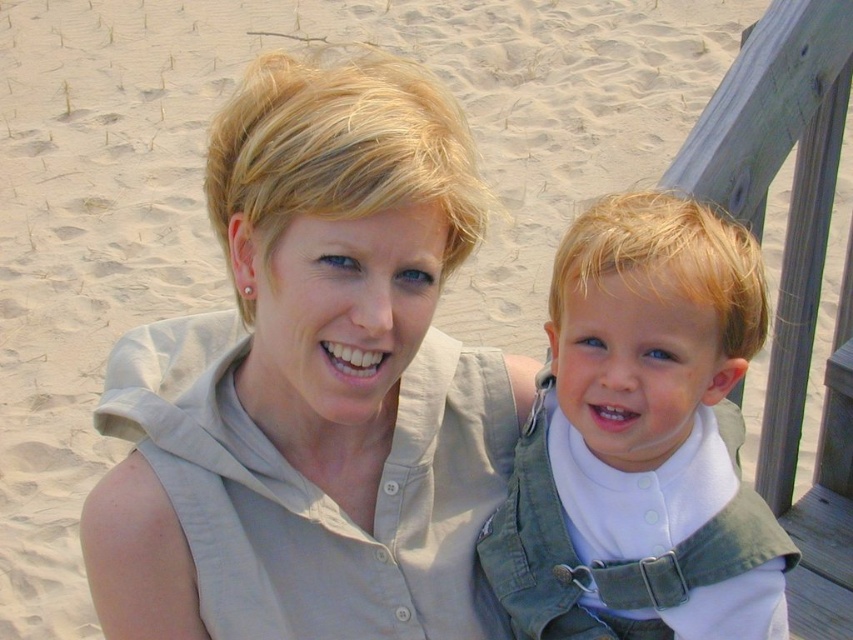
Is matte beige shirt at upper center below light green denim overalls at center?

No.

At what (x,y) coordinates should I click in order to perform the action: click on matte beige shirt at upper center. Please return your answer as a coordinate pair (x, y). Image resolution: width=853 pixels, height=640 pixels. Looking at the image, I should click on (311, 385).